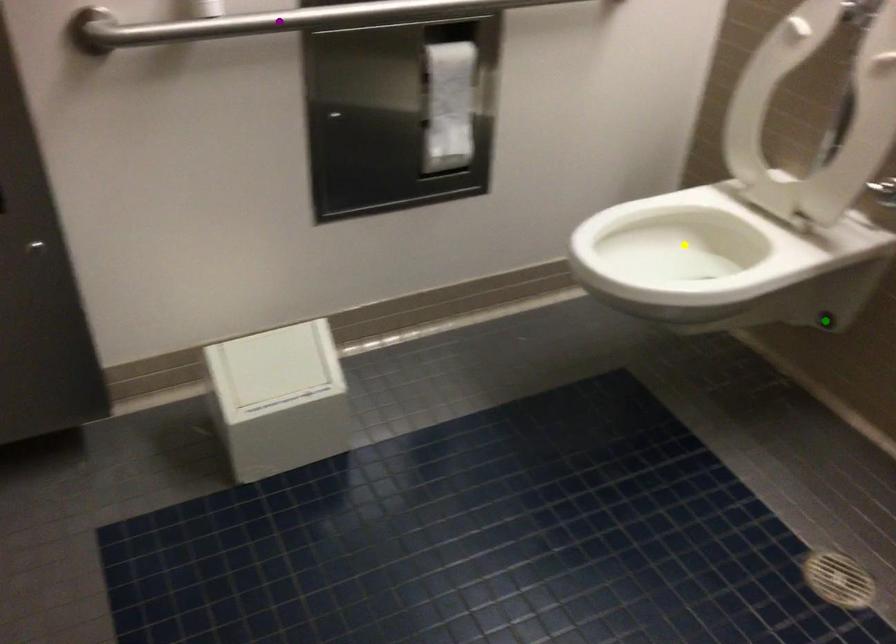
Consider the image. Order these from nearest to farthest:
yellow point, purple point, green point

purple point → yellow point → green point